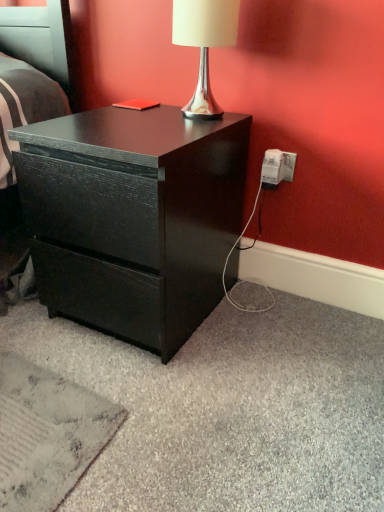
Question: Does silver metallic lamp at upper center appear on the left side of matte black drawer at center?

Choices:
 (A) yes
 (B) no

Answer: (B)

Question: Is silver metallic lamp at upper center in front of matte black drawer at center?

Choices:
 (A) no
 (B) yes

Answer: (A)

Question: Does silver metallic lamp at upper center appear on the right side of matte black drawer at center?

Choices:
 (A) yes
 (B) no

Answer: (A)

Question: Would you say silver metallic lamp at upper center is a long distance from matte black drawer at center?

Choices:
 (A) no
 (B) yes

Answer: (A)

Question: From a real-world perspective, is silver metallic lamp at upper center positioned over matte black drawer at center based on gravity?

Choices:
 (A) no
 (B) yes

Answer: (B)

Question: In the image, is silver metallic lamp at upper center positioned in front of or behind matte black drawer at center?

Choices:
 (A) front
 (B) behind

Answer: (B)

Question: In terms of size, does silver metallic lamp at upper center appear bigger or smaller than matte black drawer at center?

Choices:
 (A) big
 (B) small

Answer: (B)

Question: Is silver metallic lamp at upper center taller or shorter than matte black drawer at center?

Choices:
 (A) tall
 (B) short

Answer: (B)

Question: From the image's perspective, is silver metallic lamp at upper center above or below matte black drawer at center?

Choices:
 (A) above
 (B) below

Answer: (A)

Question: Choose the correct answer: Is white plastic power outlet at lower right inside matte black drawer at center or outside it?

Choices:
 (A) inside
 (B) outside

Answer: (B)

Question: Considering the positions of white plastic power outlet at lower right and matte black drawer at center in the image, is white plastic power outlet at lower right bigger or smaller than matte black drawer at center?

Choices:
 (A) big
 (B) small

Answer: (B)

Question: Looking at their shapes, would you say white plastic power outlet at lower right is wider or thinner than matte black drawer at center?

Choices:
 (A) wide
 (B) thin

Answer: (B)

Question: In terms of height, does white plastic power outlet at lower right look taller or shorter compared to matte black drawer at center?

Choices:
 (A) short
 (B) tall

Answer: (A)

Question: Considering the positions of matte black drawer at center and white plastic power outlet at lower right in the image, is matte black drawer at center wider or thinner than white plastic power outlet at lower right?

Choices:
 (A) thin
 (B) wide

Answer: (B)

Question: From the image's perspective, relative to white plastic power outlet at lower right, is matte black drawer at center above or below?

Choices:
 (A) above
 (B) below

Answer: (B)